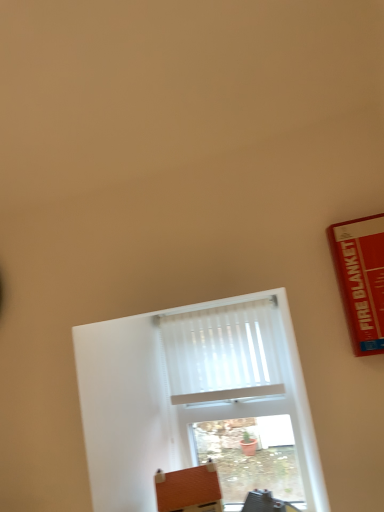
You are a GUI agent. You are given a task and a screenshot of the screen. Output one action in this format:
    pyautogui.click(x=<x>, y=<y>)
    Task: Click on the brown leather cushion at lower center
    
    Given the screenshot: What is the action you would take?
    (189, 490)

This screenshot has width=384, height=512. In order to click on brown leather cushion at lower center in this screenshot , I will do `click(189, 490)`.

Between white matte window at center and white pleated curtain at center, which one has larger width?

Wider between the two is white matte window at center.

Locate an element on the screen. Image resolution: width=384 pixels, height=512 pixels. curtain behind the white matte window at center is located at coordinates (222, 353).

From the picture: Which of these two, white matte window at center or white pleated curtain at center, is smaller?

Smaller between the two is white pleated curtain at center.

Is white pleated curtain at center at the back of white matte window at center?

Yes, white pleated curtain at center is at the back of white matte window at center.

Between white pleated curtain at center and brown leather cushion at lower center, which one is positioned behind?

Positioned behind is white pleated curtain at center.

Can you tell me how much white pleated curtain at center and brown leather cushion at lower center differ in facing direction?

The angular difference between white pleated curtain at center and brown leather cushion at lower center is 21.9 degrees.

Identify the location of furniture in front of the white pleated curtain at center. (189, 490).

Is white pleated curtain at center far away from brown leather cushion at lower center?

No, there isn't a large distance between white pleated curtain at center and brown leather cushion at lower center.

From a real-world perspective, is brown leather cushion at lower center on white matte window at center?

Incorrect, from a real-world perspective, brown leather cushion at lower center is lower than white matte window at center.

Considering the positions of objects brown leather cushion at lower center and white matte window at center in the image provided, who is in front, brown leather cushion at lower center or white matte window at center?

Positioned in front is brown leather cushion at lower center.

From the picture: Is brown leather cushion at lower center completely or partially outside of white matte window at center?

Indeed, brown leather cushion at lower center is completely outside white matte window at center.

Consider the image. What's the angular difference between brown leather cushion at lower center and white matte window at center's facing directions?

21.9 degrees.

Which is more to the right, white pleated curtain at center or white matte window at center?

Positioned to the right is white matte window at center.

From the image's perspective, who appears lower, white pleated curtain at center or white matte window at center?

white matte window at center is shown below in the image.

Is white pleated curtain at center wider or thinner than white matte window at center?

white pleated curtain at center is thinner than white matte window at center.

Where is `window above the brown leather cushion at lower center (from a real-world perspective)`? window above the brown leather cushion at lower center (from a real-world perspective) is located at coordinates (197, 407).

Is white matte window at center facing towards brown leather cushion at lower center?

Yes, white matte window at center is turned towards brown leather cushion at lower center.

Is white matte window at center taller than brown leather cushion at lower center?

Correct, white matte window at center is much taller as brown leather cushion at lower center.

Is point (125, 402) farther from camera compared to point (213, 501)?

Yes, point (125, 402) is behind point (213, 501).

Who is shorter, brown leather cushion at lower center or white pleated curtain at center?

brown leather cushion at lower center is shorter.

Which is more to the right, brown leather cushion at lower center or white pleated curtain at center?

white pleated curtain at center is more to the right.

From the image's perspective, is brown leather cushion at lower center on top of white pleated curtain at center?

No.

How far apart are brown leather cushion at lower center and white pleated curtain at center?

brown leather cushion at lower center and white pleated curtain at center are 13.51 inches apart from each other.

This screenshot has height=512, width=384. Identify the location of curtain behind the white matte window at center. (222, 353).

In order to click on furniture lying below the white pleated curtain at center (from the image's perspective) in this screenshot , I will do `click(189, 490)`.

Considering their positions, is white matte window at center positioned further to white pleated curtain at center than brown leather cushion at lower center?

The object further to white pleated curtain at center is brown leather cushion at lower center.

Which object lies nearer to the anchor point white matte window at center, brown leather cushion at lower center or white pleated curtain at center?

The object closer to white matte window at center is white pleated curtain at center.

When comparing their distances from brown leather cushion at lower center, does white matte window at center or white pleated curtain at center seem further?

The object further to brown leather cushion at lower center is white pleated curtain at center.

Considering their positions, is white pleated curtain at center positioned further to brown leather cushion at lower center than white matte window at center?

The object further to brown leather cushion at lower center is white pleated curtain at center.

Looking at the image, which one is located closer to white pleated curtain at center, brown leather cushion at lower center or white matte window at center?

Among the two, white matte window at center is located nearer to white pleated curtain at center.

Which object lies nearer to the anchor point white matte window at center, white pleated curtain at center or brown leather cushion at lower center?

white pleated curtain at center lies closer to white matte window at center than the other object.

Locate an element on the screen. window between white pleated curtain at center and brown leather cushion at lower center in the vertical direction is located at coordinates (197, 407).